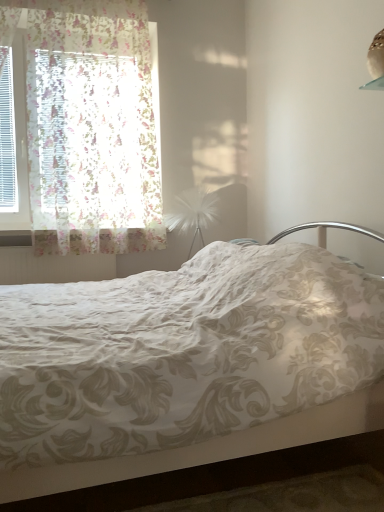
Question: Is pearl white feather at upper right to the left or to the right of metallic silver headboard at upper right in the image?

Choices:
 (A) left
 (B) right

Answer: (B)

Question: In the image, is pearl white feather at upper right positioned in front of or behind metallic silver headboard at upper right?

Choices:
 (A) behind
 (B) front

Answer: (A)

Question: Which is farther from the white textured radiator at lower left?

Choices:
 (A) floral lace curtain at left
 (B) white feather at center
 (C) pearl white feather at upper right
 (D) white floral fabric bed at center
 (E) metallic silver headboard at upper right

Answer: (C)

Question: Which of these objects is positioned farthest from the metallic silver headboard at upper right?

Choices:
 (A) pearl white feather at upper right
 (B) white textured radiator at lower left
 (C) white feather at center
 (D) white floral fabric bed at center
 (E) floral lace curtain at left

Answer: (E)